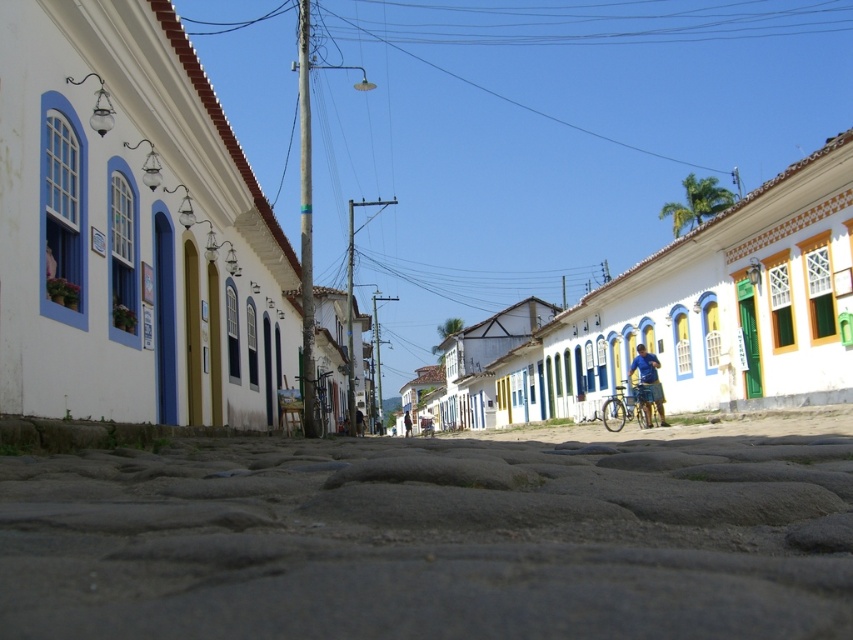
You are standing at the entrance of the street and want to take a photo of the white matte building at center. According to the scene description, where should you position yourself to capture the building in the frame?

The white matte building at center is located at point (128,228), so you should position yourself at the entrance facing towards that coordinate to capture it in your frame.

You are a delivery person with a cart that is 2 meters wide. You need to navigate through the gray cobblestone alley at center. Can your cart fit through the alley?

The gray cobblestone alley at center has a width of 2.15 meters, which is slightly wider than the cart. Therefore, the cart can fit through the alley.

Looking at this image, you are standing on the street looking up at the historic buildings. There are two points marked in the image. The first point is at coordinates point (32, 582) and the second point is at point (641, 355). Which of these two points is physically closer to you as you stand on the street?

Point (32, 582) is closer to the viewer than point (641, 355), so the first point is physically closer to you as you stand on the street.